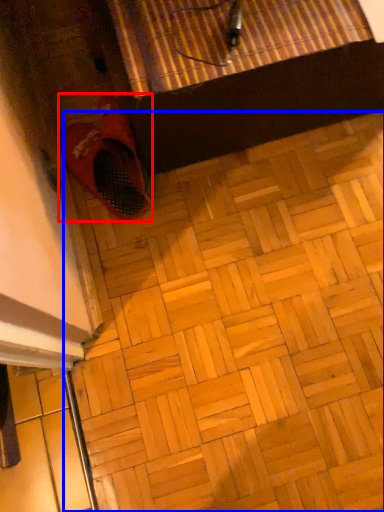
Question: Which of the following is the farthest to the observer, footwear (highlighted by a red box) or tile (highlighted by a blue box)?

Choices:
 (A) footwear
 (B) tile

Answer: (A)